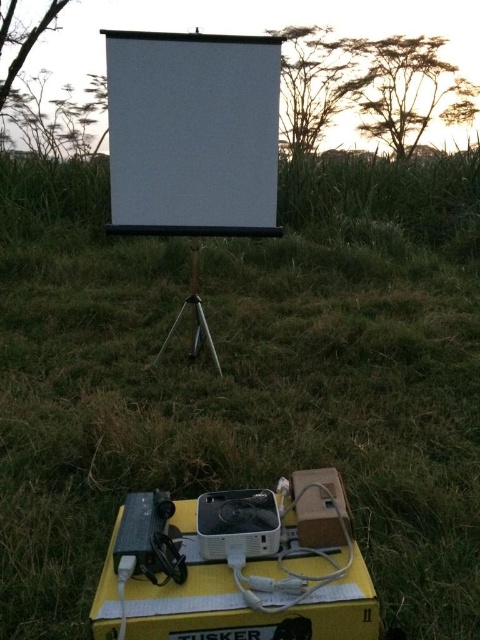
Who is shorter, white plastic projector at lower center or white matte projector screen at center?

white plastic projector at lower center is shorter.

Is white plastic projector at lower center in front of white matte projector screen at center?

That is True.

Between point (322, 544) and point (113, 134), which one is positioned behind?

Point (113, 134)

This screenshot has width=480, height=640. In order to click on white plastic projector at lower center in this screenshot , I will do `click(237, 566)`.

Does white plastic projector at lower center come in front of silver metallic tripod at center?

Yes, it is.

This screenshot has height=640, width=480. What do you see at coordinates (237, 566) in the screenshot?
I see `white plastic projector at lower center` at bounding box center [237, 566].

This screenshot has width=480, height=640. I want to click on white plastic projector at lower center, so click(x=237, y=566).

Who is positioned more to the left, white matte projector screen at center or silver metallic tripod at center?

Positioned to the left is silver metallic tripod at center.

Who is positioned more to the right, white matte projector screen at center or silver metallic tripod at center?

white matte projector screen at center

Does point (275, 68) come in front of point (216, 355)?

That is True.

Find the location of a particular element. white matte projector screen at center is located at coordinates (192, 132).